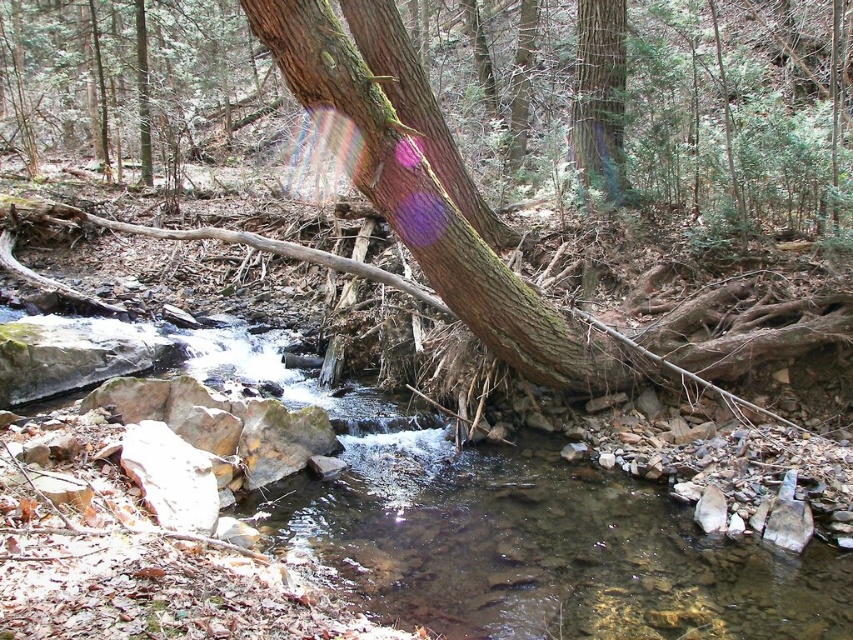
You are a hiker trying to cross the stream using the tree trunk. Based on the scene, can you determine if the clear water stream at center is wide enough to require stepping stones or if the green rough bark tree trunk at upper center can be used as a natural bridge?

The clear water stream at center is larger in size than green rough bark tree trunk at upper center, meaning the stream is wider than the tree trunk. This suggests that the tree trunk might not span the entire width of the stream, so stepping stones may be necessary to safely cross.

You are standing at the point marked as point (541, 548) in the forest scene. What do you see directly in front of you?

You see the clear water stream at center directly in front of you at point (541, 548).

You are a hiker who wants to cross the stream using the tree trunk. Based on the scene, can you safely step onto the green rough bark tree trunk at upper center to reach the other side of the clear water stream at center?

The clear water stream at center is located below the green rough bark tree trunk at upper center, so the tree trunk is positioned above the stream. This means the trunk is likely spanning over the stream, allowing you to safely step onto it to cross.